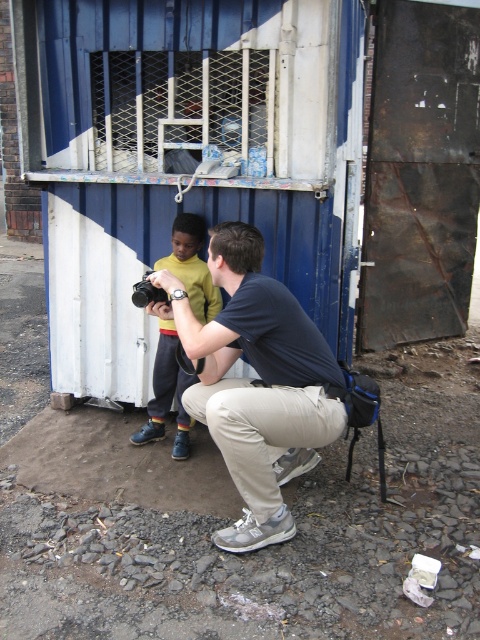
Measure the distance between blue painted metal container at center and camera.

They are 2.58 meters apart.

Does blue painted metal container at center come in front of black plastic camera at center?

Yes, it is in front of black plastic camera at center.

Identify the location of blue painted metal container at center. This screenshot has height=640, width=480. (184, 156).

Does blue painted metal container at center appear over yellow cotton shirt at center?

Yes.

Can you confirm if blue painted metal container at center is smaller than yellow cotton shirt at center?

No, blue painted metal container at center is not smaller than yellow cotton shirt at center.

Between point (249, 216) and point (186, 212), which one is positioned behind?

Positioned behind is point (186, 212).

Image resolution: width=480 pixels, height=640 pixels. I want to click on blue painted metal container at center, so click(x=184, y=156).

Is matte blue shirt at center positioned at the back of yellow cotton shirt at center?

No, matte blue shirt at center is closer to the viewer.

Looking at this image, who is positioned more to the right, matte blue shirt at center or yellow cotton shirt at center?

matte blue shirt at center

Between point (241, 484) and point (171, 252), which one is positioned behind?

The point (171, 252) is more distant.

You are a GUI agent. You are given a task and a screenshot of the screen. Output one action in this format:
    pyautogui.click(x=<x>, y=<y>)
    Task: Click on the matte blue shirt at center
    The image size is (480, 640).
    Given the screenshot: What is the action you would take?
    pyautogui.click(x=259, y=381)